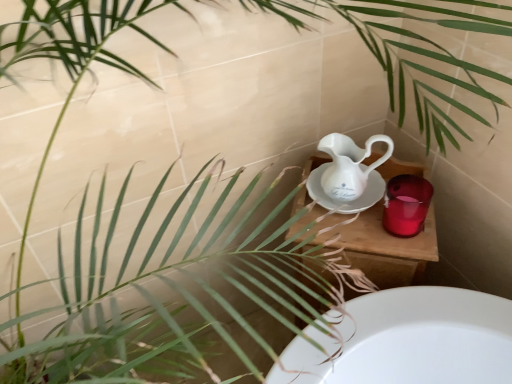
Question: Can you confirm if wooden table at center is bigger than glossy ceramic mug at upper right?

Choices:
 (A) no
 (B) yes

Answer: (B)

Question: Considering the relative positions of wooden table at center and glossy ceramic mug at upper right in the image provided, is wooden table at center behind glossy ceramic mug at upper right?

Choices:
 (A) no
 (B) yes

Answer: (B)

Question: From the image's perspective, would you say wooden table at center is shown under glossy ceramic mug at upper right?

Choices:
 (A) no
 (B) yes

Answer: (B)

Question: From a real-world perspective, is wooden table at center over glossy ceramic mug at upper right?

Choices:
 (A) yes
 (B) no

Answer: (B)

Question: Is wooden table at center smaller than glossy ceramic mug at upper right?

Choices:
 (A) yes
 (B) no

Answer: (B)

Question: In terms of height, does glossy ceramic mug at upper right look taller or shorter compared to wooden table at center?

Choices:
 (A) short
 (B) tall

Answer: (A)

Question: Is glossy ceramic mug at upper right bigger or smaller than wooden table at center?

Choices:
 (A) small
 (B) big

Answer: (A)

Question: Is glossy ceramic mug at upper right to the left or to the right of wooden table at center in the image?

Choices:
 (A) right
 (B) left

Answer: (A)

Question: Considering the positions of point (393, 195) and point (392, 256), is point (393, 195) closer or farther from the camera than point (392, 256)?

Choices:
 (A) closer
 (B) farther

Answer: (B)

Question: In terms of height, does white porcelain jug at center look taller or shorter compared to wooden table at center?

Choices:
 (A) short
 (B) tall

Answer: (A)

Question: In the image, is white porcelain jug at center on the left side or the right side of wooden table at center?

Choices:
 (A) right
 (B) left

Answer: (B)

Question: In terms of width, does white porcelain jug at center look wider or thinner when compared to wooden table at center?

Choices:
 (A) wide
 (B) thin

Answer: (B)

Question: Relative to wooden table at center, is white porcelain jug at center in front or behind?

Choices:
 (A) front
 (B) behind

Answer: (A)

Question: Based on their sizes in the image, would you say white porcelain jug at center is bigger or smaller than glossy ceramic mug at upper right?

Choices:
 (A) big
 (B) small

Answer: (A)

Question: From the image's perspective, relative to glossy ceramic mug at upper right, is white porcelain jug at center above or below?

Choices:
 (A) above
 (B) below

Answer: (A)